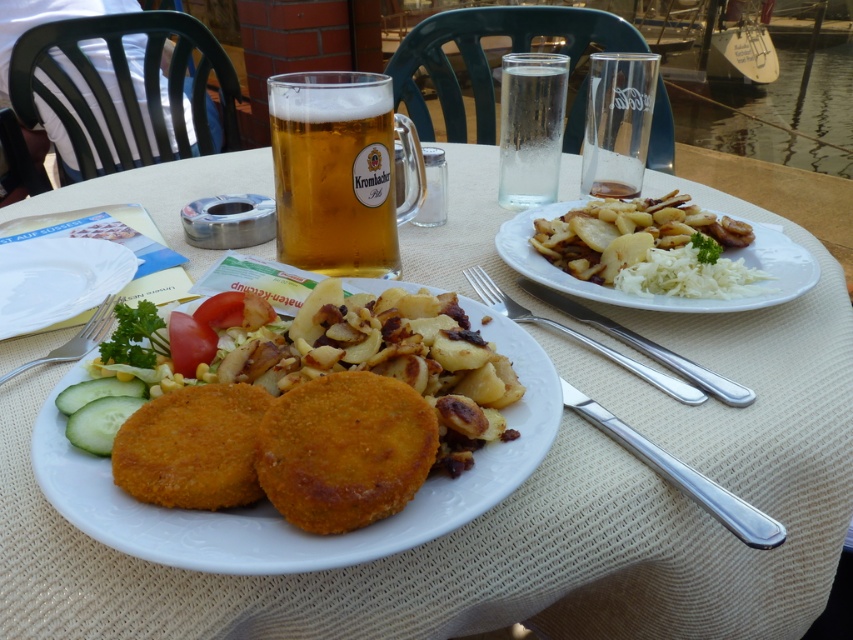
Question: Is golden crispy cutlets at center to the right of golden glass mug at upper center from the viewer's perspective?

Choices:
 (A) yes
 (B) no

Answer: (A)

Question: Which object appears farthest from the camera in this image?

Choices:
 (A) clear glass water at upper center
 (B) green crisp cucumber at center

Answer: (A)

Question: Estimate the real-world distances between objects in this image. Which object is farther from the silvermetallicfork at right?

Choices:
 (A) clear glass water at upper center
 (B) silvermetallicknife at right
 (C) white ceramic plate at center
 (D) green crisp cucumber at center

Answer: (C)

Question: Which object appears closest to the camera in this image?

Choices:
 (A) white matte plate at upper right
 (B) green crisp cucumber at center

Answer: (B)

Question: Does white matte plate at upper right have a smaller size compared to white ceramic plate at center?

Choices:
 (A) yes
 (B) no

Answer: (B)

Question: Does silvermetallicfork at right lie behind green crisp cucumber at center?

Choices:
 (A) yes
 (B) no

Answer: (B)